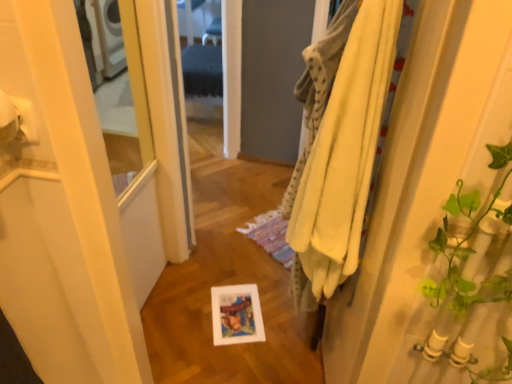
Question: From the image's perspective, relative to yellow soft towel at right, acting as the second bath towel starting from the top, is white matte toilet paper at upper left above or below?

Choices:
 (A) below
 (B) above

Answer: (B)

Question: Relative to yellow soft towel at right, acting as the second bath towel starting from the top, is white matte toilet paper at upper left in front or behind?

Choices:
 (A) front
 (B) behind

Answer: (A)

Question: Which is farther from the white matte toilet paper at upper left?

Choices:
 (A) yellow cotton bath towel at right, the 1th bath towel when ordered from top to bottom
 (B) yellow fabric at right
 (C) yellow soft towel at right, the 1th bath towel ordered from the bottom

Answer: (B)

Question: Which object is positioned closest to the yellow fabric at right?

Choices:
 (A) yellow soft towel at right, the 1th bath towel ordered from the bottom
 (B) yellow cotton bath towel at right, the 1th bath towel when ordered from top to bottom
 (C) white matte toilet paper at upper left

Answer: (A)